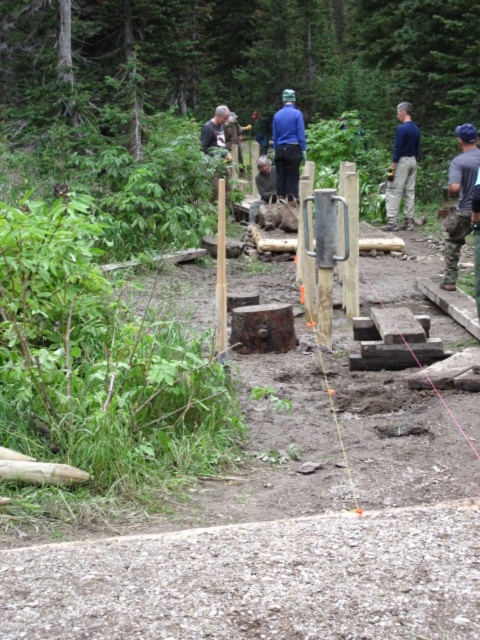
You are standing at the point marked by the yellow string line in the forest scene. There is a gravelly dirt trail at lower center represented by point (255, 579). Can you walk directly to the gravelly dirt trail at lower center without crossing any logs or debris?

The gravelly dirt trail at lower center is represented by point (255, 579). Since the scene description mentions scattered debris including wooden logs and pieces of wood in the foreground, it is possible that the path to the trail may be obstructed by these obstacles. However, the exact location of the debris isn

You are a new construction worker arriving at the site. You see the blue fabric construction worker at right and the wooden post at center. Which object is larger in size?

The blue fabric construction worker at right is bigger than the wooden post at center.

You are a safety inspector with a 5 meter long safety rope. You need to secure the camouflage pants at right and the blue fabric construction worker at right to ensure they are within a safe distance. Can your rope reach between them?

The distance between the camouflage pants at right and the blue fabric construction worker at right is 4.80 meters, so the 5 meter safety rope is long enough to secure them within a safe distance.